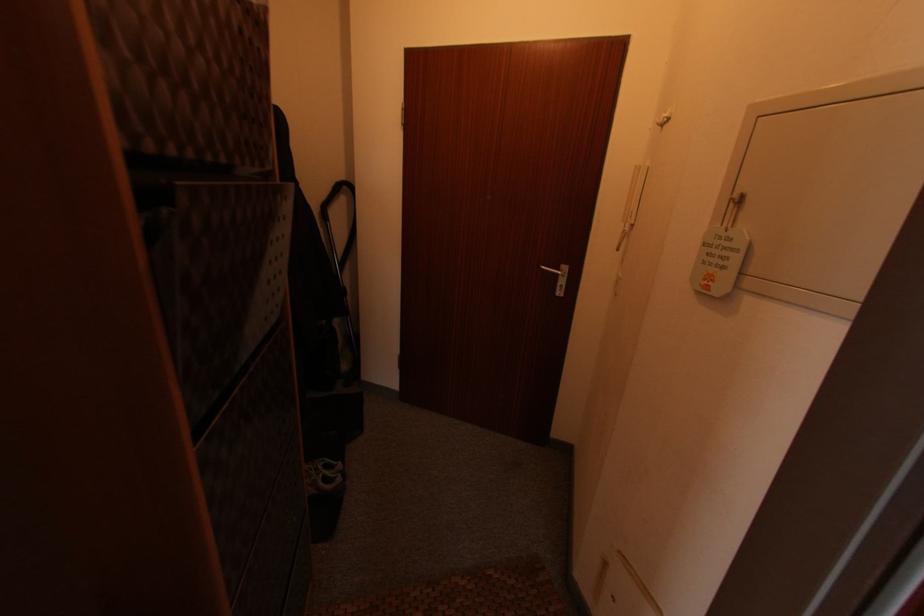
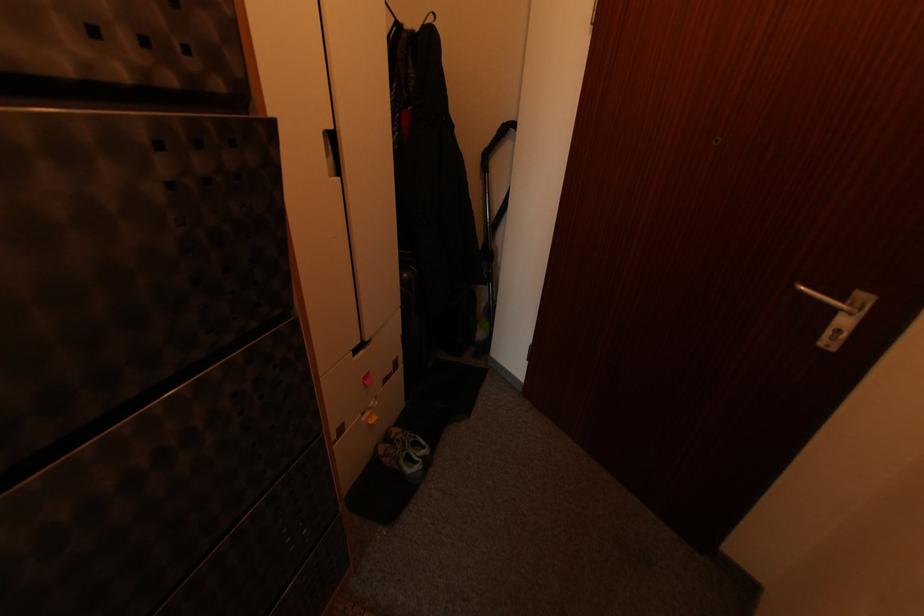
Where in the second image is the point corresponding to (543,268) from the first image?

(804, 289)